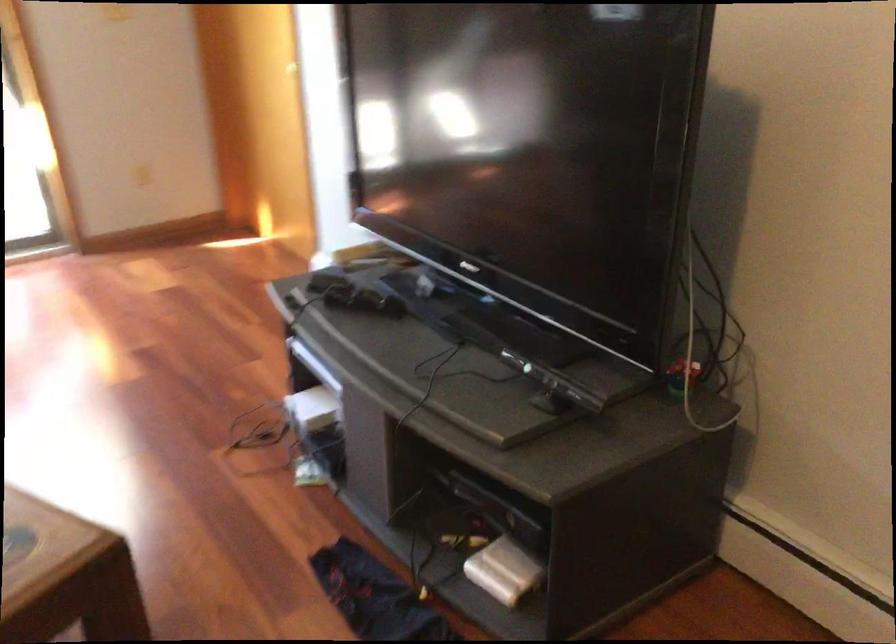
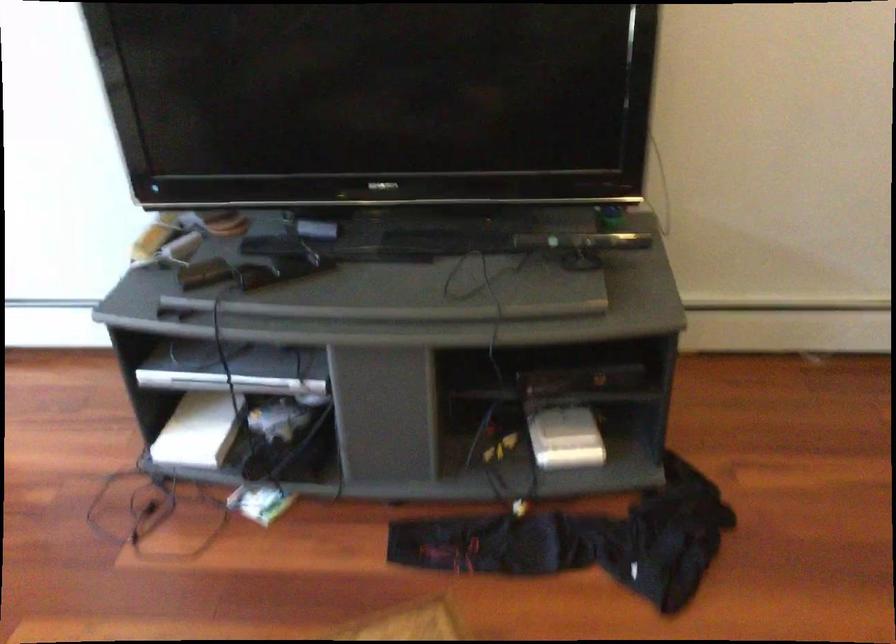
In the second image, find the point that corresponds to (x=556, y=377) in the first image.

(582, 241)